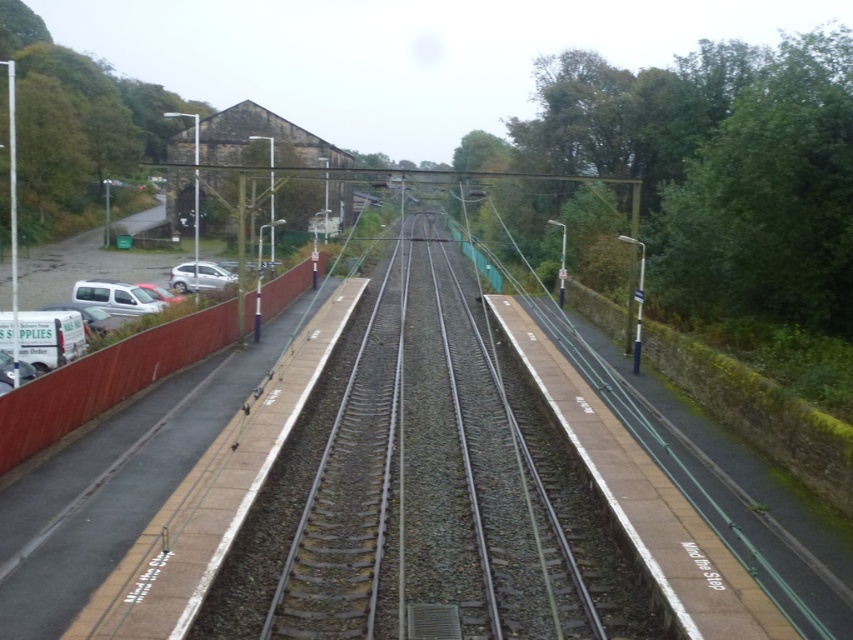
Question: Which object is farther from the camera taking this photo?

Choices:
 (A) satin silver car at left
 (B) white matte van at left
 (C) smooth metal train track at center

Answer: (A)

Question: Is smooth metal train track at center to the left of white matte van at left from the viewer's perspective?

Choices:
 (A) yes
 (B) no

Answer: (B)

Question: Estimate the real-world distances between objects in this image. Which object is farther from the white matte van at left?

Choices:
 (A) smooth metal train track at center
 (B) satin silver car at left

Answer: (A)

Question: Does white matte van at left have a larger size compared to satin silver car at left?

Choices:
 (A) yes
 (B) no

Answer: (B)

Question: Does smooth metal train track at center appear on the right side of white matte van at left?

Choices:
 (A) yes
 (B) no

Answer: (A)

Question: Which of the following is the closest to the observer?

Choices:
 (A) (399, 518)
 (B) (74, 294)
 (C) (198, 276)

Answer: (A)